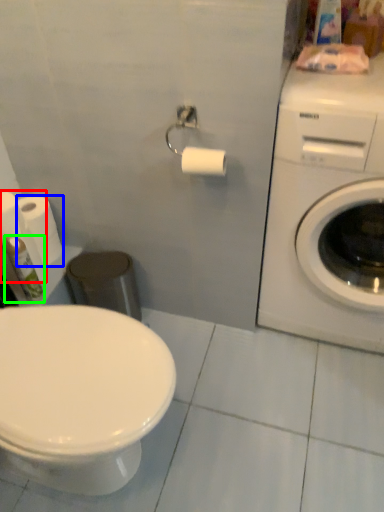
Question: Which object is positioned farthest from toilet paper (highlighted by a red box)? Select from toilet paper (highlighted by a blue box) and toiletry (highlighted by a green box).

Choices:
 (A) toilet paper
 (B) toiletry

Answer: (A)